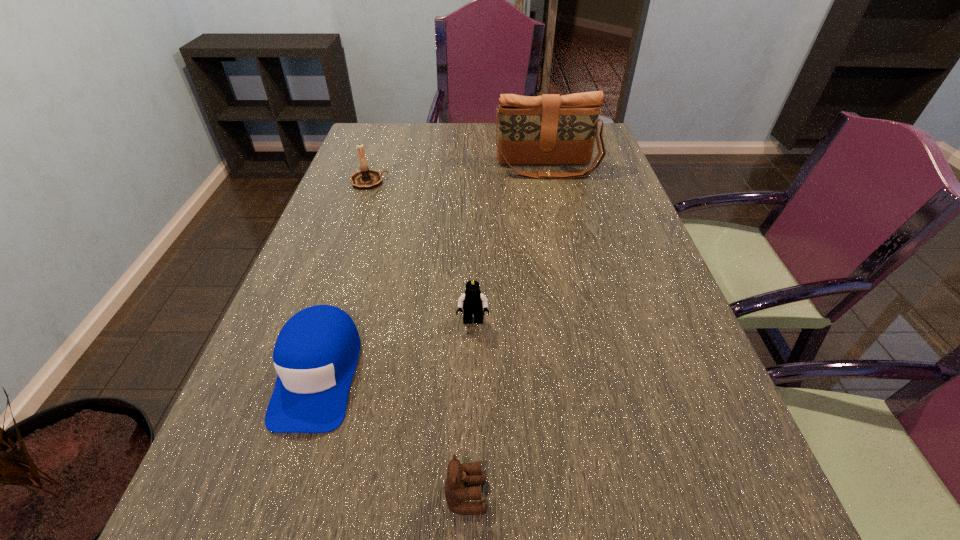
Where is `shoulder bag`? The image size is (960, 540). shoulder bag is located at coordinates (x=550, y=129).

You are a GUI agent. You are given a task and a screenshot of the screen. Output one action in this format:
    pyautogui.click(x=<x>, y=<y>)
    Task: Click on the rightmost object
    This screenshot has height=540, width=960.
    Given the screenshot: What is the action you would take?
    pyautogui.click(x=550, y=129)

The height and width of the screenshot is (540, 960). Identify the location of candle holder. (366, 178).

At what (x,y) coordinates should I click in order to perform the action: click on Lego. Please return your answer as a coordinate pair (x, y). The height and width of the screenshot is (540, 960). Looking at the image, I should click on (472, 301).

Where is `baseball cap`? This screenshot has width=960, height=540. baseball cap is located at coordinates (315, 355).

Where is `the nearest object`? the nearest object is located at coordinates (458, 475).

Where is `vacant space located 0.120m on the front-facing side of the tallest object`? vacant space located 0.120m on the front-facing side of the tallest object is located at coordinates (555, 201).

At what (x,y) coordinates should I click in order to perform the action: click on free space located 0.330m on the front of the candle holder. Please return your answer as a coordinate pair (x, y). Image resolution: width=960 pixels, height=540 pixels. Looking at the image, I should click on (340, 263).

Where is `vacant space positioned 0.270m on the front-facing side of the Lego`? vacant space positioned 0.270m on the front-facing side of the Lego is located at coordinates (471, 455).

Locate an element on the screen. vacant space located 0.110m on the front-facing side of the baseball cap is located at coordinates (276, 504).